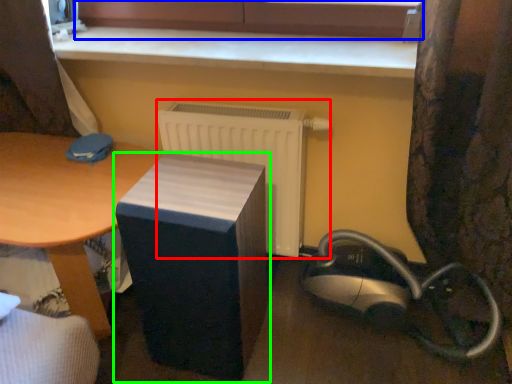
Question: Which object is positioned farthest from radiator (highlighted by a red box)? Select from bay window (highlighted by a blue box) and furniture (highlighted by a green box).

Choices:
 (A) bay window
 (B) furniture

Answer: (A)